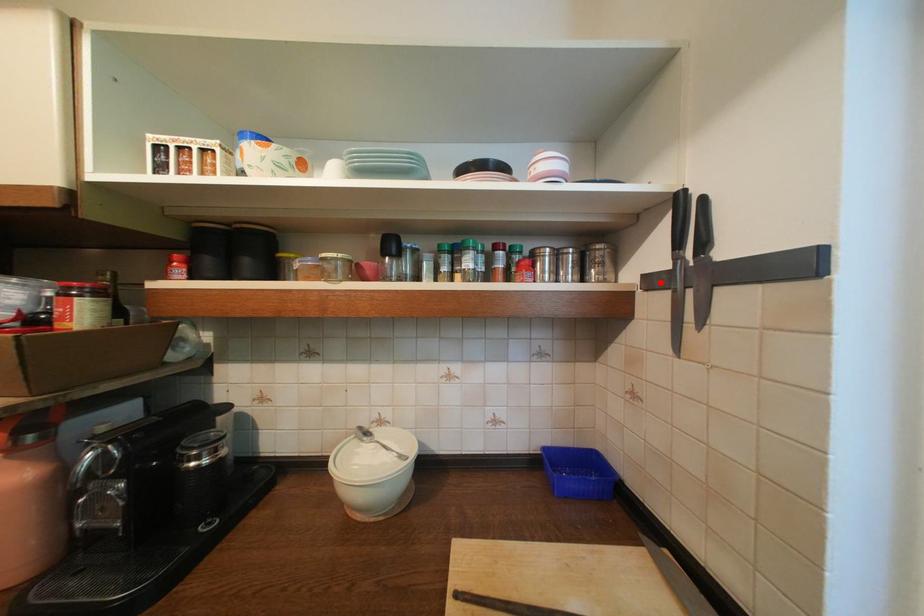
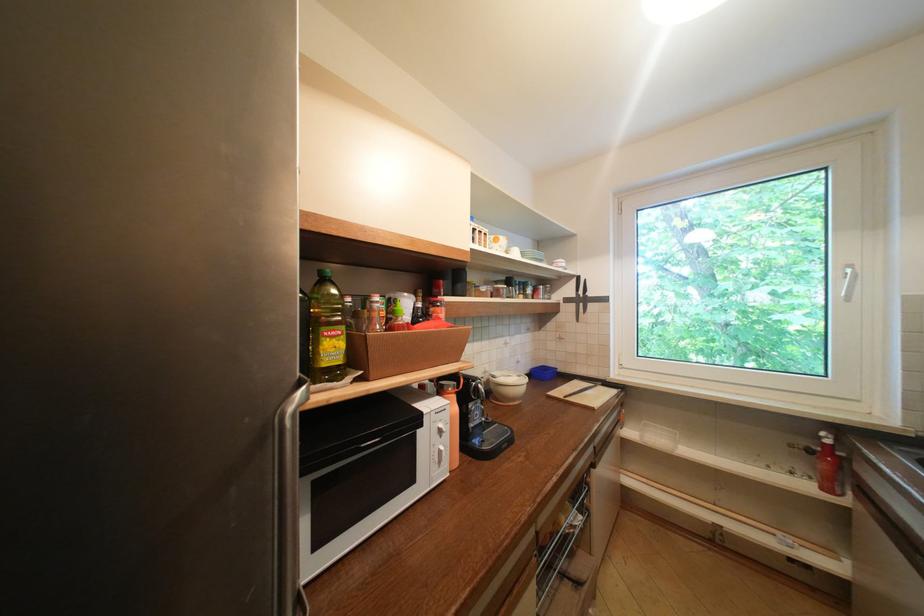
Find the pixel in the second image that matches the highlighted location in the first image.

(575, 301)